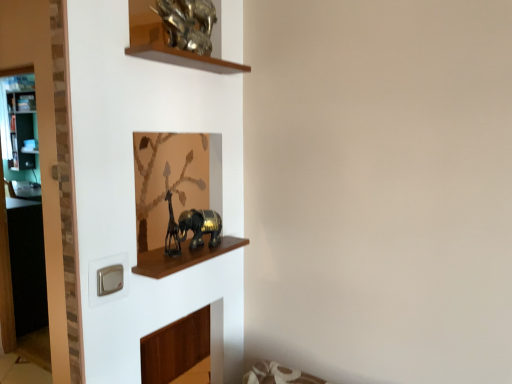
Question: Which direction should I rotate to look at gold metallic elephant at center, acting as the 1th animal starting from the bottom?

Choices:
 (A) left
 (B) right

Answer: (A)

Question: Are transparent glass door at left and shiny brown cabinet at center located far from each other?

Choices:
 (A) yes
 (B) no

Answer: (A)

Question: From a real-world perspective, is transparent glass door at left located higher than shiny brown cabinet at center?

Choices:
 (A) no
 (B) yes

Answer: (A)

Question: Considering the relative sizes of transparent glass door at left and shiny brown cabinet at center in the image provided, is transparent glass door at left shorter than shiny brown cabinet at center?

Choices:
 (A) yes
 (B) no

Answer: (B)

Question: Does transparent glass door at left have a larger size compared to shiny brown cabinet at center?

Choices:
 (A) yes
 (B) no

Answer: (A)

Question: Does transparent glass door at left have a smaller size compared to shiny brown cabinet at center?

Choices:
 (A) no
 (B) yes

Answer: (A)

Question: Does transparent glass door at left have a greater height compared to shiny brown cabinet at center?

Choices:
 (A) yes
 (B) no

Answer: (A)

Question: Is shiny brown cabinet at center outside gold metallic sculpture at upper center, which ranks as the 1th animal in top-to-bottom order?

Choices:
 (A) yes
 (B) no

Answer: (A)

Question: Is gold metallic sculpture at upper center, which ranks as the 1th animal in top-to-bottom order, at the back of shiny brown cabinet at center?

Choices:
 (A) yes
 (B) no

Answer: (B)

Question: Is gold metallic sculpture at upper center, which is the second animal in bottom-to-top order, located within shiny brown cabinet at center?

Choices:
 (A) no
 (B) yes

Answer: (A)

Question: Does shiny brown cabinet at center lie behind gold metallic sculpture at upper center, which ranks as the 1th animal in top-to-bottom order?

Choices:
 (A) yes
 (B) no

Answer: (B)

Question: Is shiny brown cabinet at center facing towards gold metallic sculpture at upper center, which ranks as the 1th animal in top-to-bottom order?

Choices:
 (A) yes
 (B) no

Answer: (B)

Question: Is shiny brown cabinet at center taller than gold metallic sculpture at upper center, which ranks as the 1th animal in top-to-bottom order?

Choices:
 (A) no
 (B) yes

Answer: (A)

Question: Does gold metallic elephant at center, acting as the 1th animal starting from the bottom, turn towards transparent glass door at left?

Choices:
 (A) no
 (B) yes

Answer: (A)